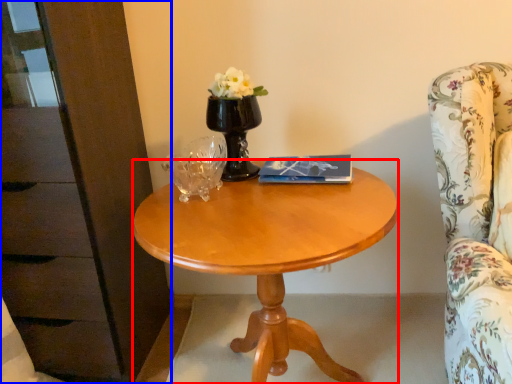
Question: Among these objects, which one is farthest to the camera, desk (highlighted by a red box) or dresser (highlighted by a blue box)?

Choices:
 (A) desk
 (B) dresser

Answer: (B)